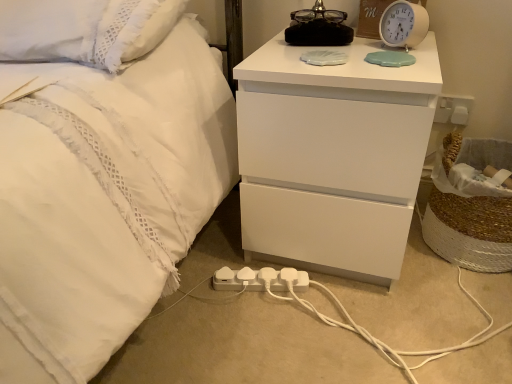
Identify the location of free space behind white plastic extension cord at lower center. (238, 255).